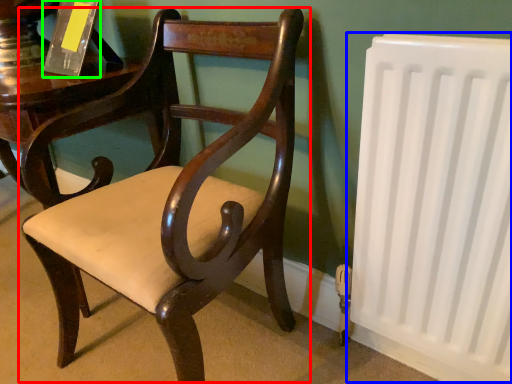
Question: Based on their relative distances, which object is nearer to chair (highlighted by a red box)? Choose from radiator (highlighted by a blue box) and paperback book (highlighted by a green box).

Choices:
 (A) radiator
 (B) paperback book

Answer: (A)